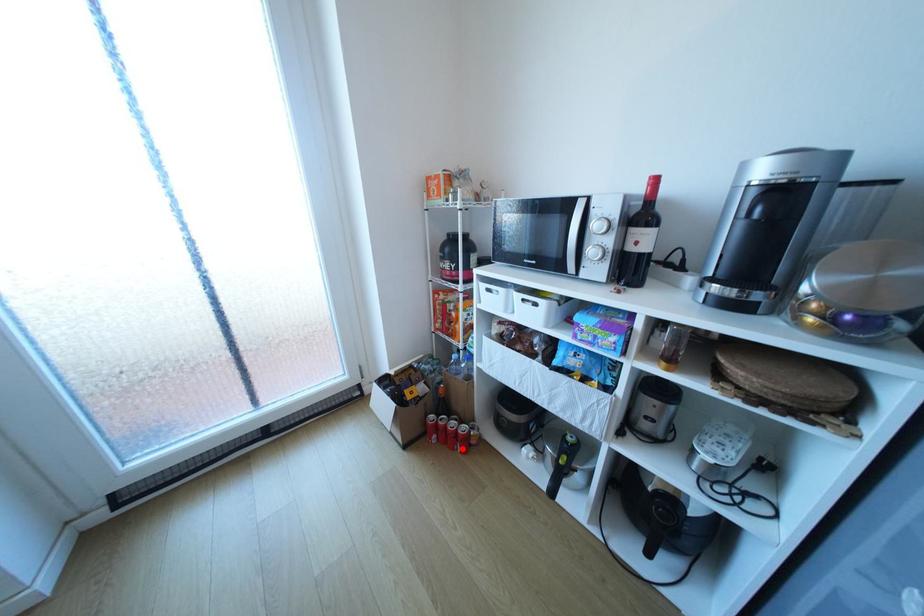
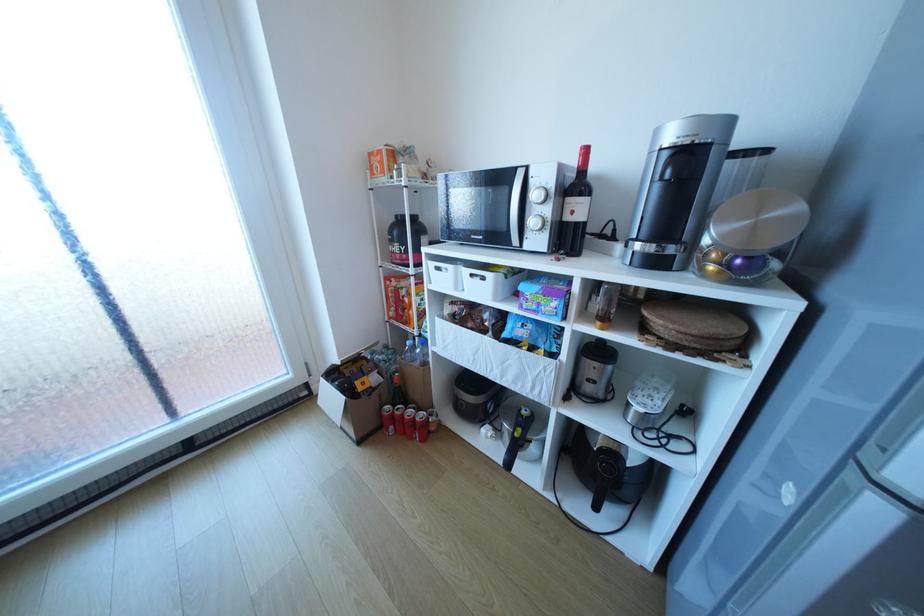
In the second image, find the point that corresponds to the highlighted location in the first image.

(420, 438)